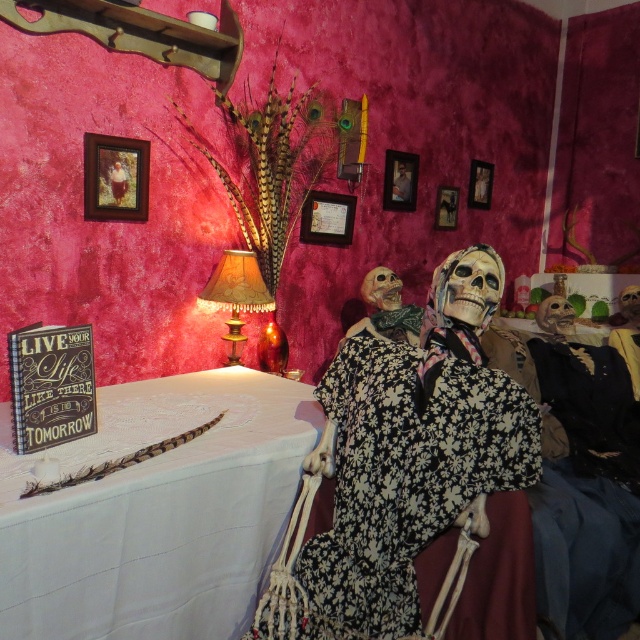
Question: Estimate the real-world distances between objects in this image. Which object is farther from the black floral fabric dress at center?

Choices:
 (A) leather textured lampshade at center
 (B) smooth wooden frame at upper center

Answer: (B)

Question: Does white lace tablecloth at upper left have a greater width compared to leather textured lampshade at center?

Choices:
 (A) no
 (B) yes

Answer: (B)

Question: Does white lace tablecloth at upper left appear on the left side of leather textured lampshade at center?

Choices:
 (A) no
 (B) yes

Answer: (B)

Question: Is leather textured lampshade at center to the left of smooth wooden frame at upper center from the viewer's perspective?

Choices:
 (A) no
 (B) yes

Answer: (B)

Question: Which object is positioned farthest from the smooth wooden frame at upper center?

Choices:
 (A) leather textured lampshade at center
 (B) white lace tablecloth at upper left
 (C) black floral fabric dress at center

Answer: (B)

Question: Which point is farther to the camera?

Choices:
 (A) (161, 564)
 (B) (371, 442)
 (C) (404, 186)

Answer: (C)